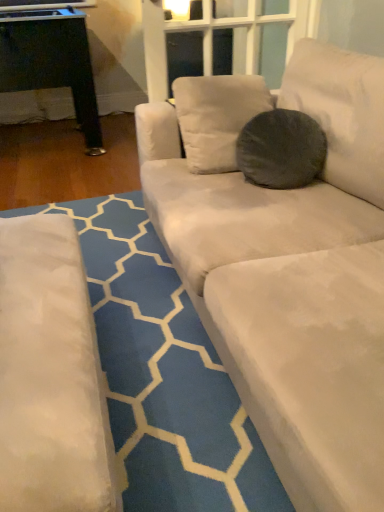
Question: From a real-world perspective, is white fabric couch at lower right above or below dark gray fuzzy pillow at center?

Choices:
 (A) above
 (B) below

Answer: (B)

Question: Visually, is white fabric couch at lower right positioned to the left or to the right of dark gray fuzzy pillow at center?

Choices:
 (A) right
 (B) left

Answer: (B)

Question: In terms of height, does white fabric couch at lower right look taller or shorter compared to dark gray fuzzy pillow at center?

Choices:
 (A) short
 (B) tall

Answer: (A)

Question: From the image's perspective, relative to white fabric couch at lower right, is dark gray fuzzy pillow at center above or below?

Choices:
 (A) above
 (B) below

Answer: (A)

Question: Is dark gray fuzzy pillow at center in front of or behind white fabric couch at lower right in the image?

Choices:
 (A) behind
 (B) front

Answer: (A)

Question: Considering the positions of dark gray fuzzy pillow at center and white fabric couch at lower right in the image, is dark gray fuzzy pillow at center bigger or smaller than white fabric couch at lower right?

Choices:
 (A) big
 (B) small

Answer: (B)

Question: Considering the relative positions of dark gray fuzzy pillow at center and white fabric couch at lower right in the image provided, is dark gray fuzzy pillow at center to the left or to the right of white fabric couch at lower right?

Choices:
 (A) right
 (B) left

Answer: (A)